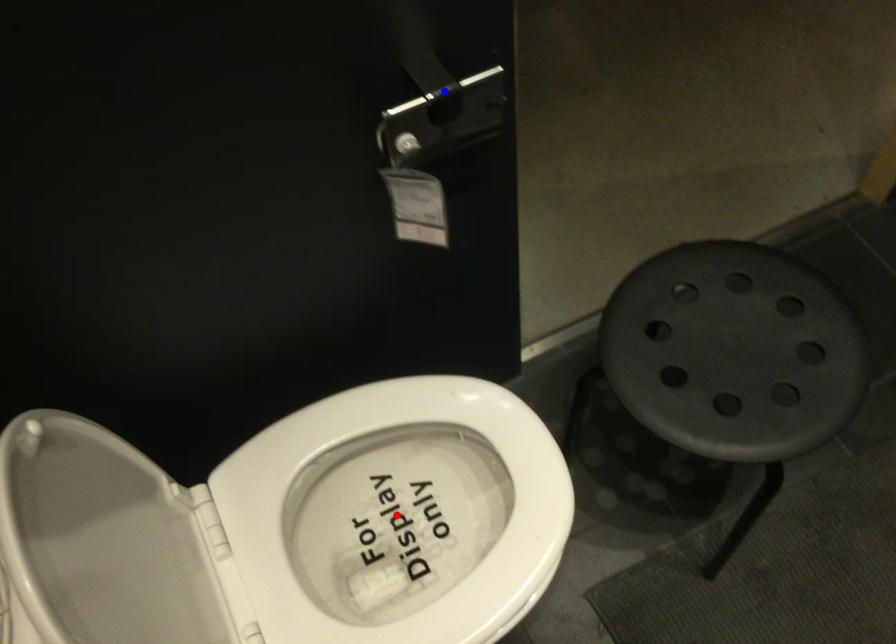
Question: Two points are marked on the image. Which point is closer to the camera?

Choices:
 (A) Blue point is closer.
 (B) Red point is closer.

Answer: (A)